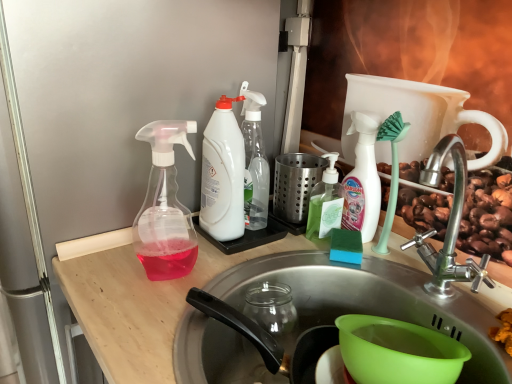
This screenshot has width=512, height=384. I want to click on vacant area that lies between transparent plastic spray bottle at left, the first bottle when ordered from left to right, and white matte bottle at center, marked as the 1th bottle in a right-to-left arrangement, so click(x=259, y=255).